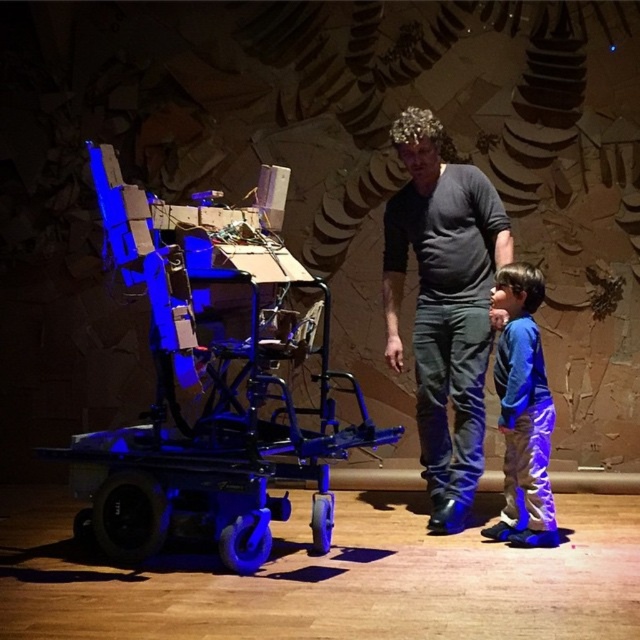
Question: Which point is closer to the camera taking this photo?

Choices:
 (A) (524, 500)
 (B) (435, 412)

Answer: (A)

Question: Can you confirm if dark gray t-shirt at center is wider than blue cotton shirt at center?

Choices:
 (A) no
 (B) yes

Answer: (B)

Question: Does dark gray t-shirt at center appear on the left side of blue cotton shirt at center?

Choices:
 (A) no
 (B) yes

Answer: (B)

Question: Does dark gray t-shirt at center come behind blue cotton shirt at center?

Choices:
 (A) no
 (B) yes

Answer: (B)